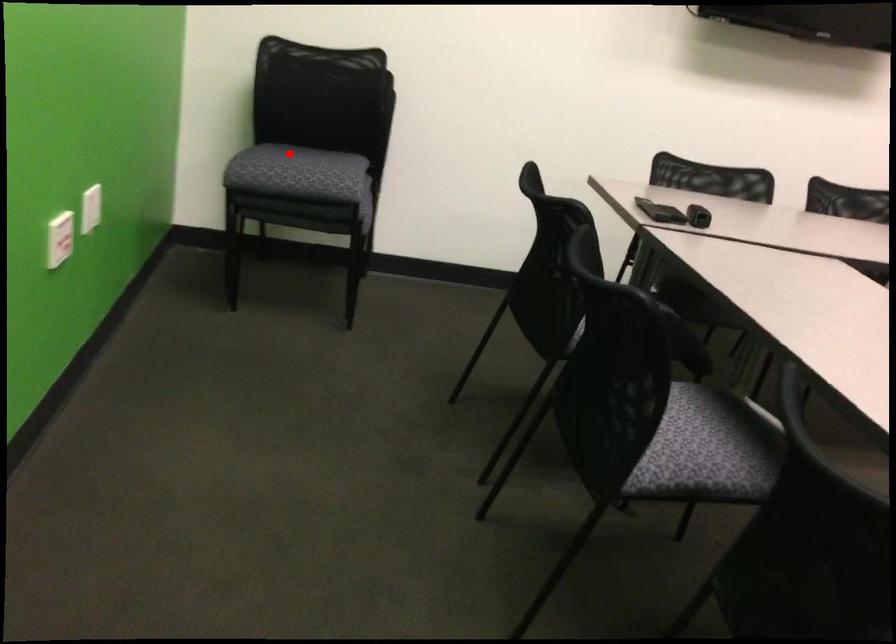
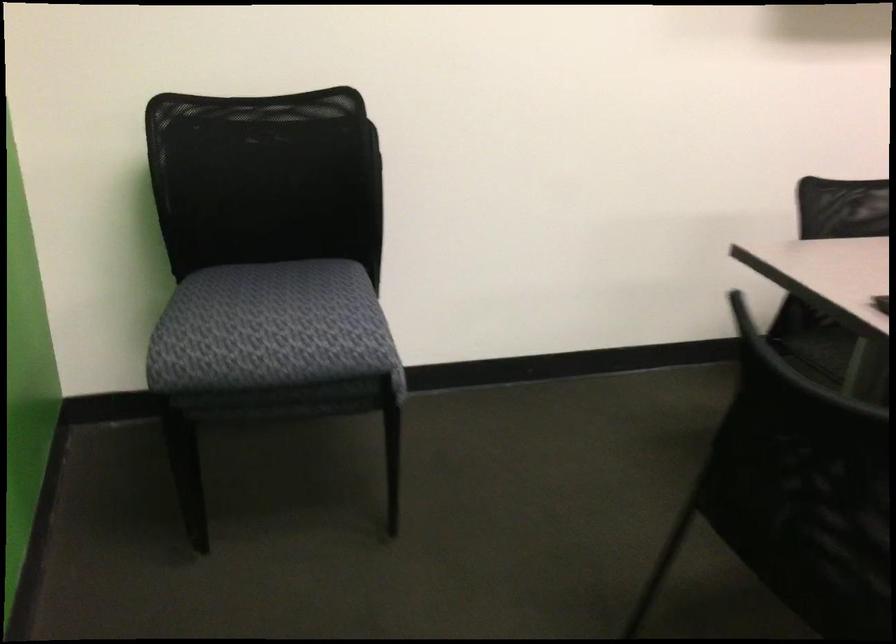
Locate, in the second image, the point that corresponds to the highlighted location in the first image.

(271, 328)